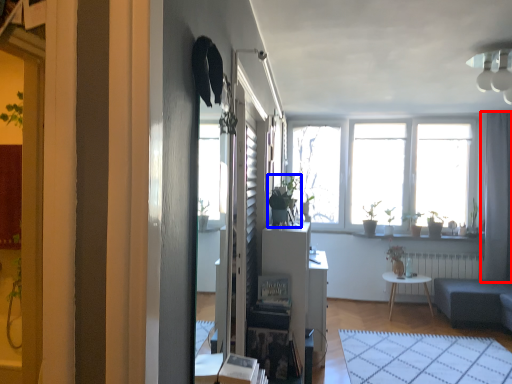
Question: Among these objects, which one is nearest to the camera, curtain (highlighted by a red box) or houseplant (highlighted by a blue box)?

Choices:
 (A) curtain
 (B) houseplant

Answer: (B)